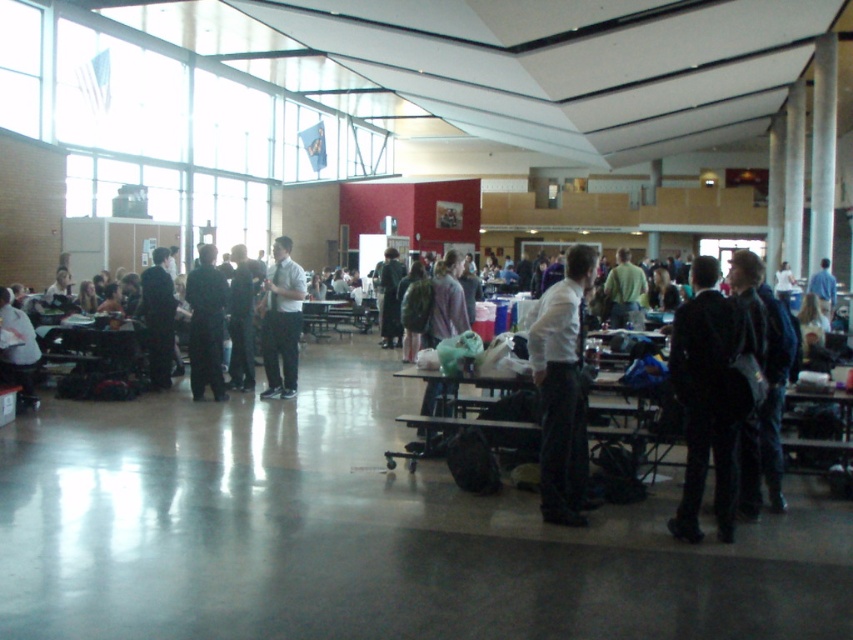
You are standing at the entrance of the cafeteria and want to find the person wearing the matte white shirt at center. According to the coordinates provided, where should you look relative to the entrance?

The matte white shirt at center is located at coordinates point [281,321], which means it is positioned near the center of the image. Since the entrance is typically located at the bottom of the image, you should look towards the upper middle section of the room to find the person wearing the matte white shirt at center.

You are standing in the cafeteria and want to walk to the point that is closer to you. Which point should you head towards, point (267, 326) or point (210, 268)?

You should head towards point (267, 326) because it is closer to the viewer than point (210, 268).